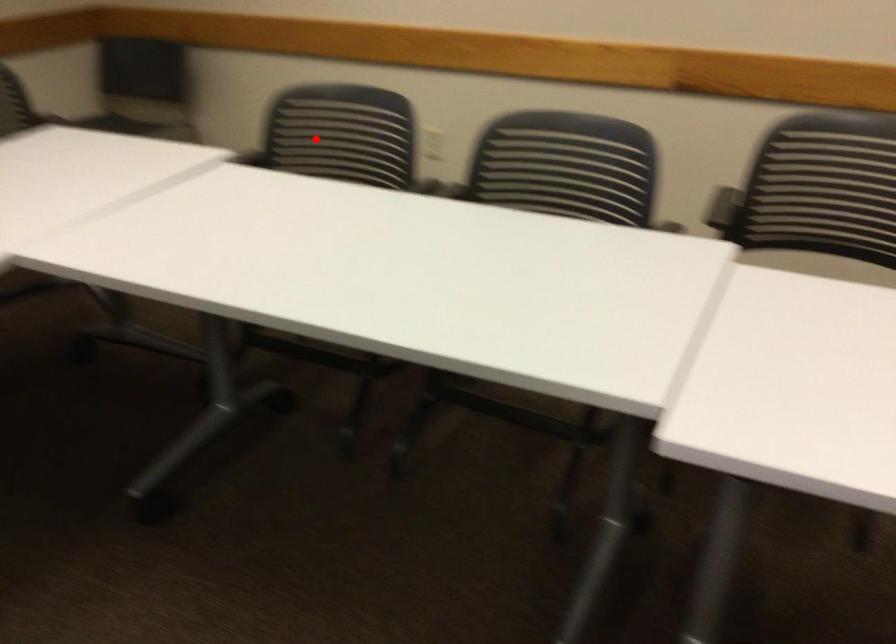
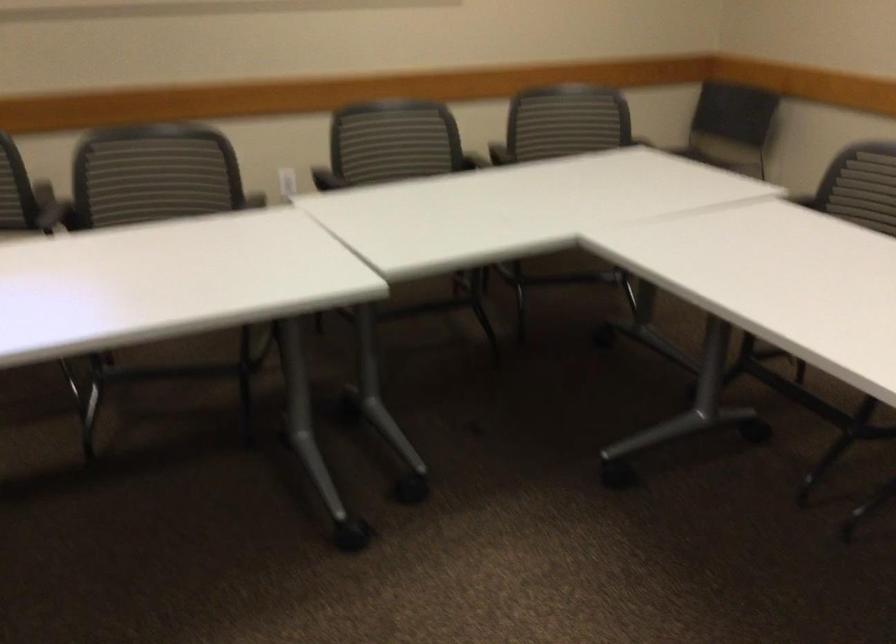
Find the pixel in the second image that matches the highlighted location in the first image.

(866, 185)